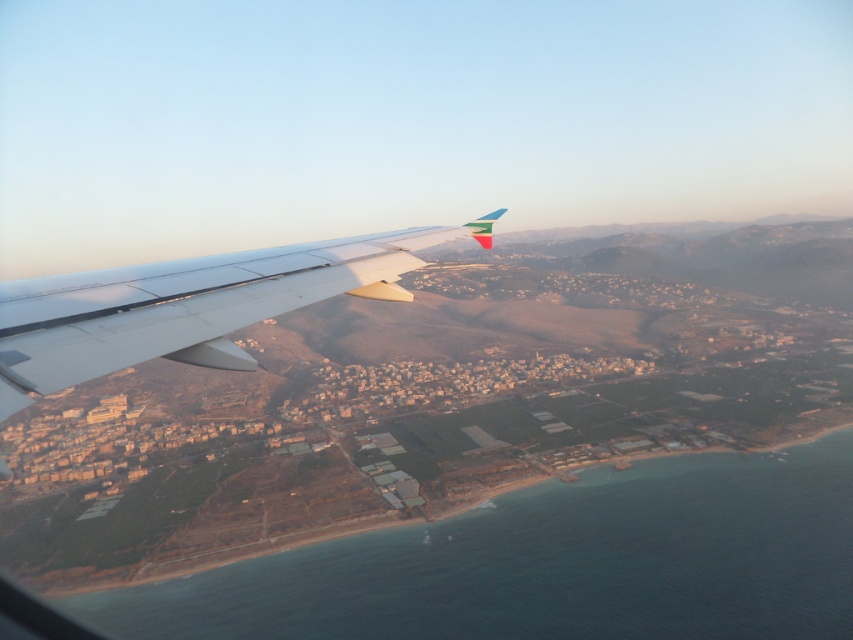
Is the position of blue water at lower left more distant than that of metallic gray wing at upper left?

Yes, blue water at lower left is behind metallic gray wing at upper left.

Who is lower down, blue water at lower left or metallic gray wing at upper left?

Positioned lower is blue water at lower left.

Is point (497, 536) farther from viewer compared to point (119, 294)?

Yes, point (497, 536) is behind point (119, 294).

The image size is (853, 640). Identify the location of blue water at lower left. (553, 563).